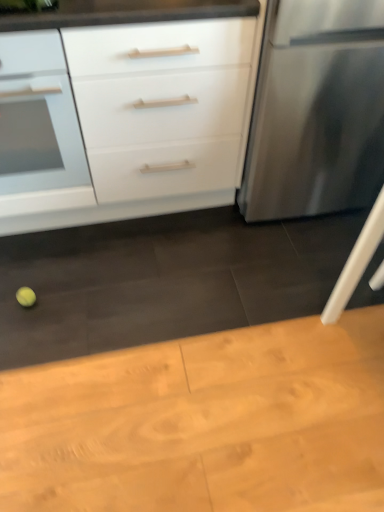
You are a GUI agent. You are given a task and a screenshot of the screen. Output one action in this format:
    pyautogui.click(x=<x>, y=<y>)
    Task: Click on the vacant area located to the right-hand side of yellow matte tennis ball at lower left
    
    Given the screenshot: What is the action you would take?
    click(x=73, y=297)